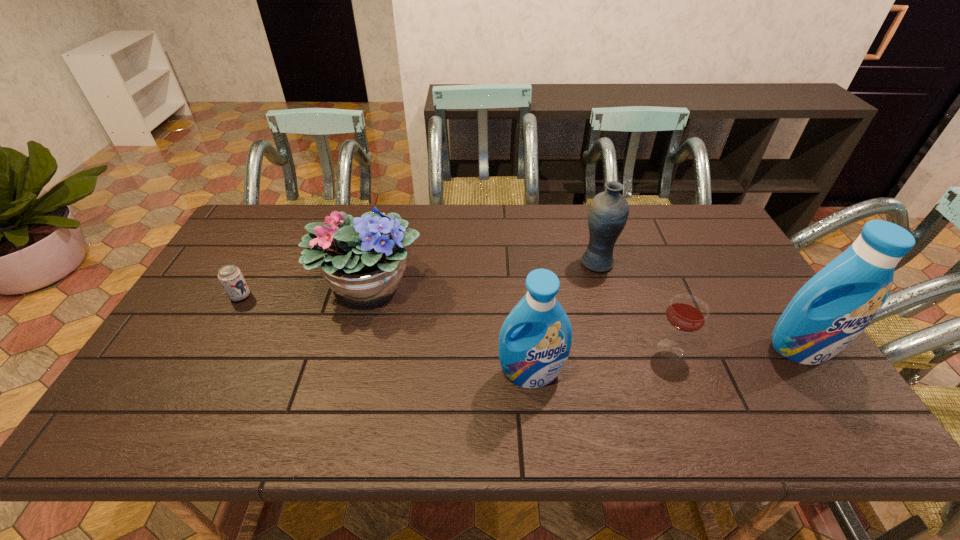
Identify the location of free location that satisfies the following two spatial constraints: 1. on the front side of the wineglass; 2. on the left side of the leftmost object. The height and width of the screenshot is (540, 960). (211, 349).

Find the location of a particular element. vacant space that satisfies the following two spatial constraints: 1. on the front side of the fourth object from left to right; 2. on the left side of the second object from right to left is located at coordinates (622, 349).